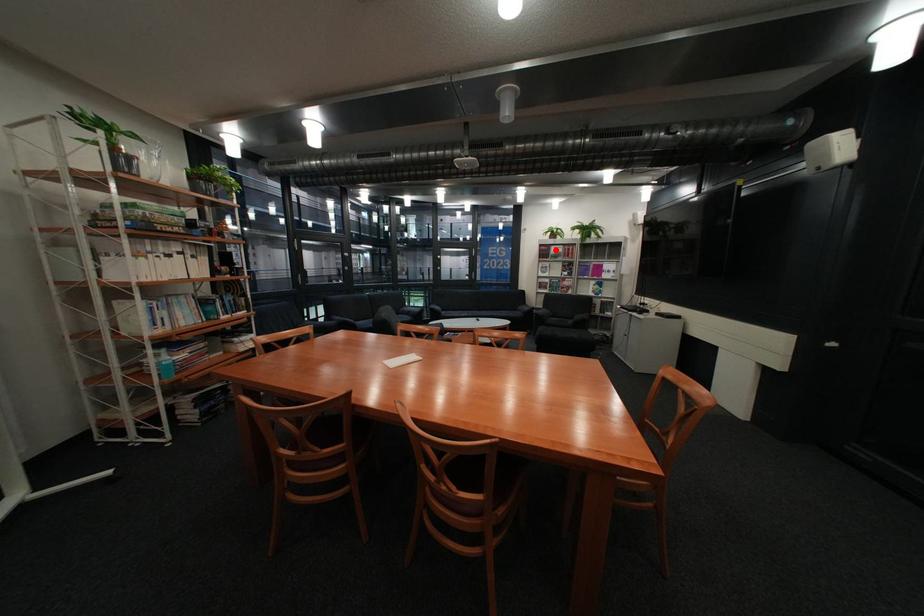
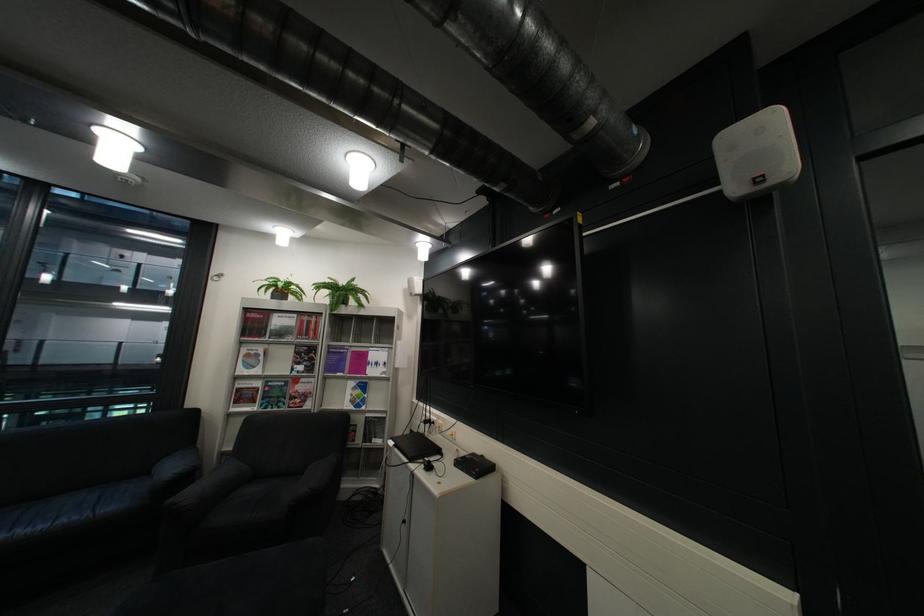
Find the pixel in the second image that matches the highlighted location in the first image.

(260, 320)